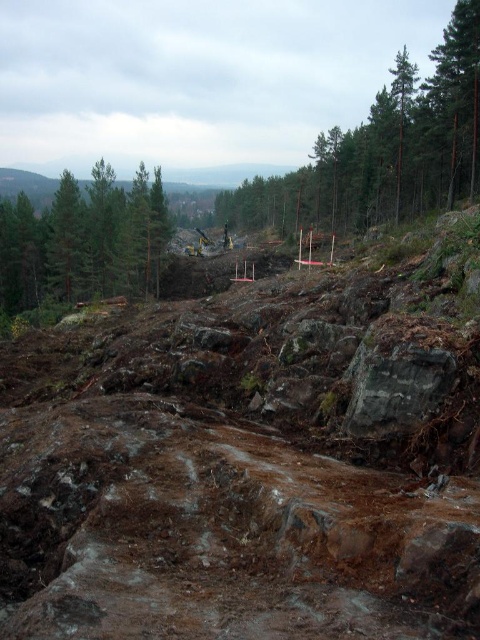
Question: Which point is farther to the camera?

Choices:
 (A) green matte tree at upper left
 (B) green textured tree at center
 (C) gray rough rock at center

Answer: (A)

Question: Can you confirm if green textured tree at center is thinner than green matte tree at upper left?

Choices:
 (A) yes
 (B) no

Answer: (A)

Question: Does brown earthy dirt track at center appear under green textured tree at upper left?

Choices:
 (A) yes
 (B) no

Answer: (A)

Question: Which point appears closest to the camera in this image?

Choices:
 (A) (233, 204)
 (B) (369, 381)

Answer: (B)

Question: Can you confirm if green textured tree at center is positioned to the right of green matte tree at upper left?

Choices:
 (A) no
 (B) yes

Answer: (B)

Question: Which of the following is the closest to the observer?

Choices:
 (A) (268, 204)
 (B) (433, 346)

Answer: (B)